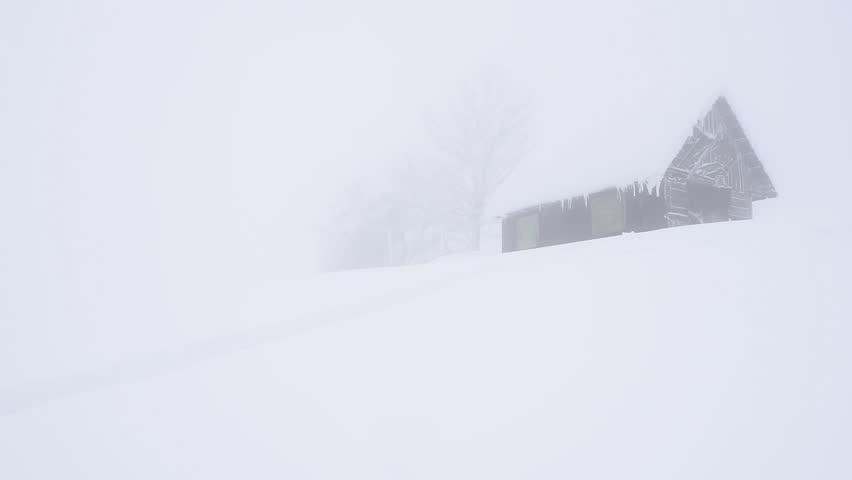
Find the location of `window`. window is located at coordinates (524, 235), (607, 208).